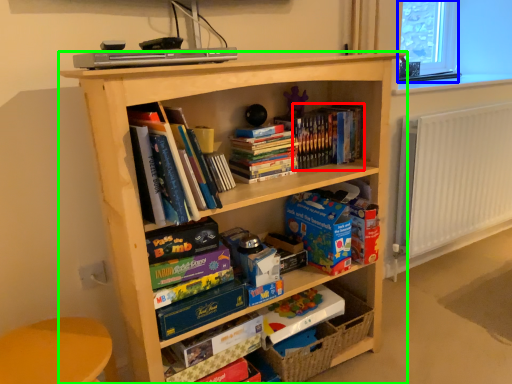
Question: Which object is the closest to the book (highlighted by a red box)? Choose among these: window screen (highlighted by a blue box) or bookcase (highlighted by a green box).

Choices:
 (A) window screen
 (B) bookcase

Answer: (B)